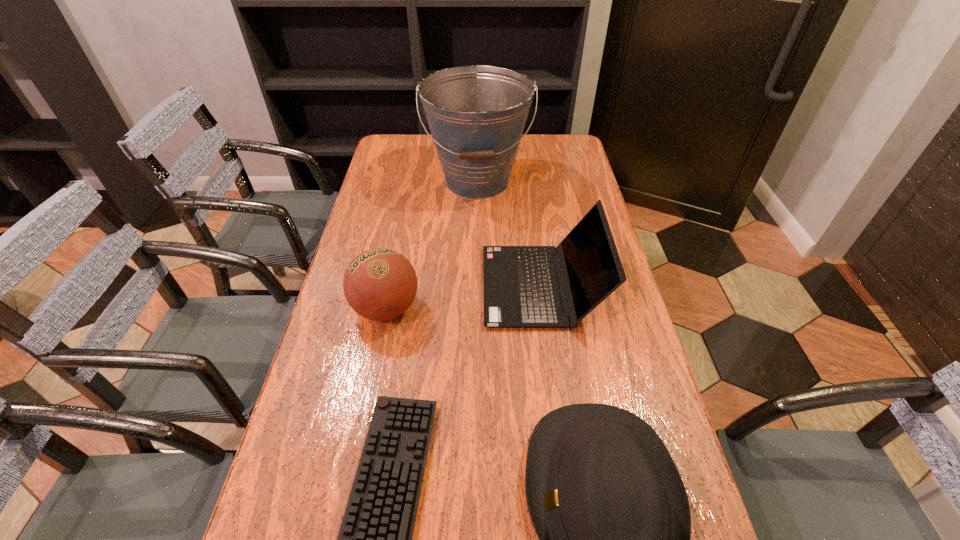
This screenshot has height=540, width=960. In order to click on object that is at the left edge in this screenshot , I will do `click(380, 284)`.

The image size is (960, 540). I want to click on object that is at the right edge, so (x=521, y=290).

The height and width of the screenshot is (540, 960). In the image, there is a desktop. Identify the location of vacant space at the left edge. (316, 372).

Find the location of a particular element. This screenshot has width=960, height=540. vacant area at the right edge is located at coordinates (574, 169).

Where is `vacant region at the far right corner of the desktop`? This screenshot has height=540, width=960. vacant region at the far right corner of the desktop is located at coordinates (565, 147).

Identify the location of free spot between the bucket and the laptop computer. This screenshot has width=960, height=540. (510, 234).

Where is `free spot between the basketball and the bucket`? The width and height of the screenshot is (960, 540). free spot between the basketball and the bucket is located at coordinates tap(432, 245).

You are a GUI agent. You are given a task and a screenshot of the screen. Output one action in this format:
    pyautogui.click(x=<x>, y=<y>)
    Task: Click on the free spot between the basketball and the laptop computer
    
    Given the screenshot: What is the action you would take?
    pyautogui.click(x=464, y=298)

Find the location of a particular element. The width and height of the screenshot is (960, 540). object identified as the closest to the fourth tallest object is located at coordinates pyautogui.click(x=375, y=538).

Where is `object identified as the closest to the fourth tallest object`? The height and width of the screenshot is (540, 960). object identified as the closest to the fourth tallest object is located at coordinates (375, 538).